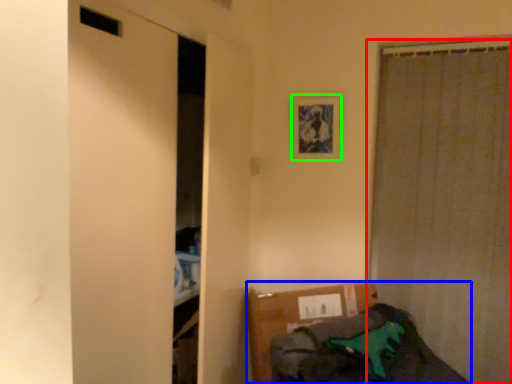
Question: Which object is the farthest from curtain (highlighted by a red box)? Choose among these: furniture (highlighted by a blue box) or picture frame (highlighted by a green box).

Choices:
 (A) furniture
 (B) picture frame

Answer: (A)